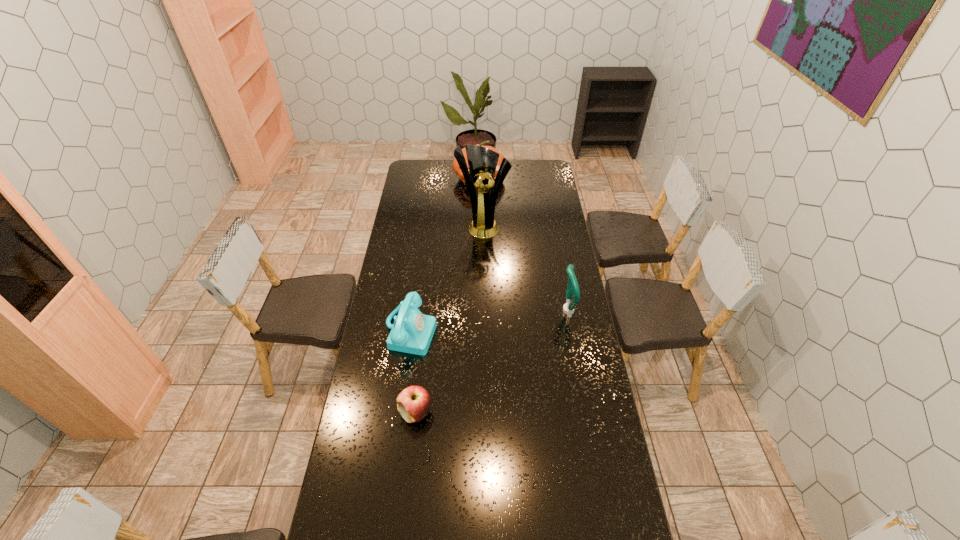
The width and height of the screenshot is (960, 540). Find the location of `empty location between the shortest object and the rightmost object`. empty location between the shortest object and the rightmost object is located at coordinates (491, 362).

Locate an element on the screen. The width and height of the screenshot is (960, 540). free space between the second shortest object and the rightmost object is located at coordinates (489, 320).

Locate an element on the screen. The image size is (960, 540). vacant area that lies between the nearest object and the tallest object is located at coordinates (449, 319).

Identify the location of vacant area that lies between the fourth tallest object and the nearest object. (413, 371).

Find the location of a particular element. The image size is (960, 540). unoccupied area between the fourth nearest object and the bottle opener is located at coordinates (524, 268).

In order to click on empty space that is in between the shortest object and the fourth nearest object in this screenshot , I will do `click(449, 319)`.

You are a GUI agent. You are given a task and a screenshot of the screen. Output one action in this format:
    pyautogui.click(x=<x>, y=<y>)
    Task: Click on the vacant area between the second shortest object and the pumpkin
    
    Given the screenshot: What is the action you would take?
    [445, 254]

This screenshot has width=960, height=540. Identify the location of free space between the pumpkin and the bottle opener. (522, 244).

This screenshot has width=960, height=540. Find the location of `empty location between the nearest object and the telephone`. empty location between the nearest object and the telephone is located at coordinates (413, 371).

Identify the location of object that stands as the third closest to the telephone. Image resolution: width=960 pixels, height=540 pixels. (572, 287).